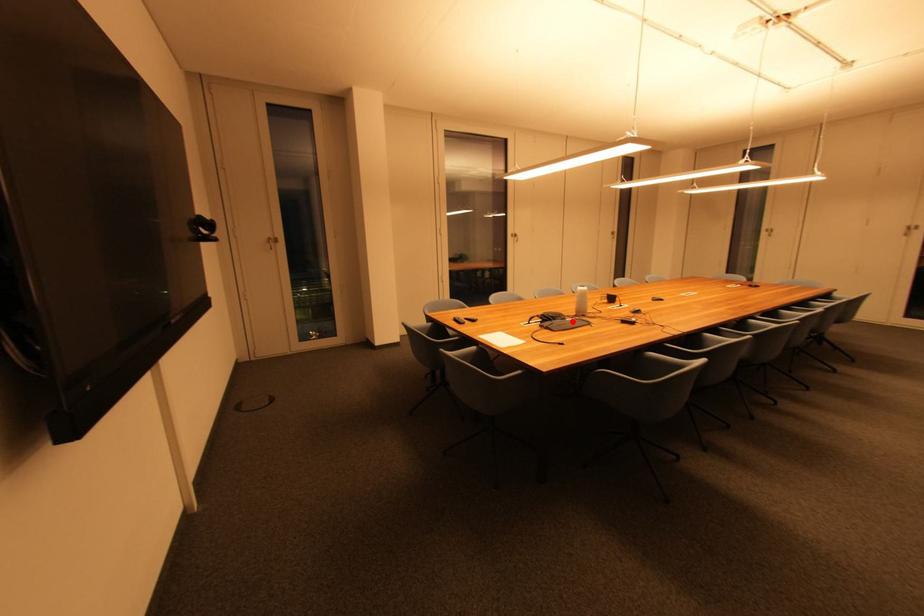
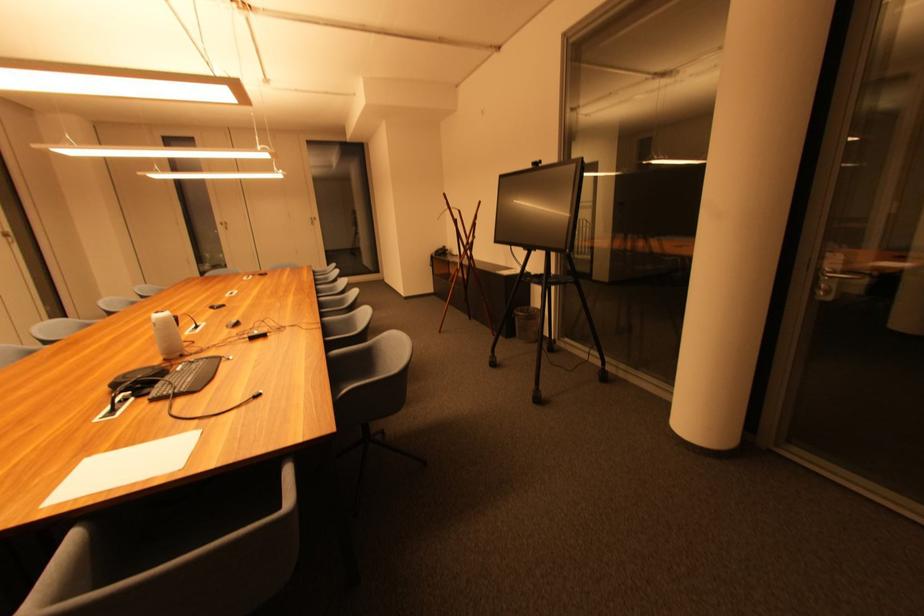
Question: I am providing you with two images of the same scene from different viewpoints. A red point is marked on the first image. Is the red point's position out of view in image 2?

Choices:
 (A) Yes
 (B) No

Answer: (B)